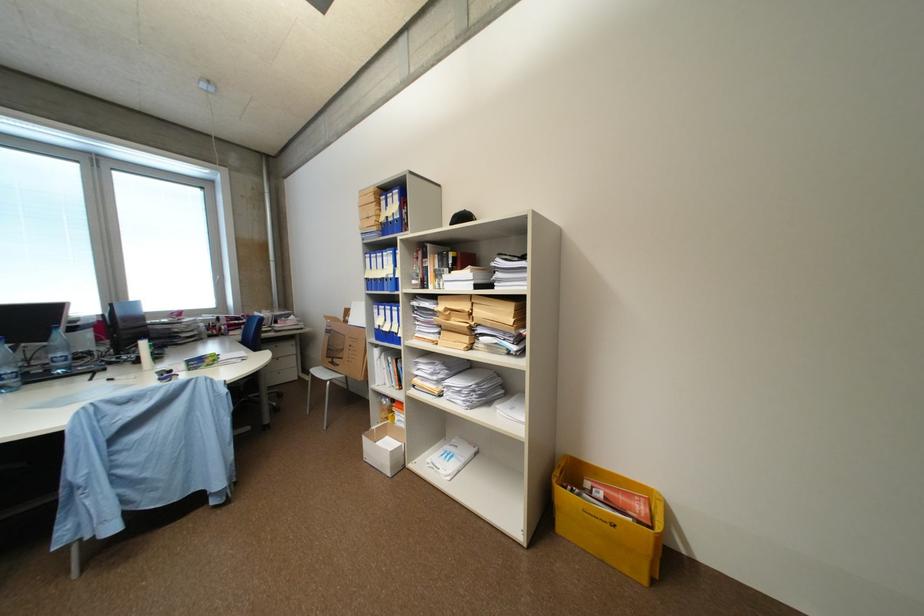
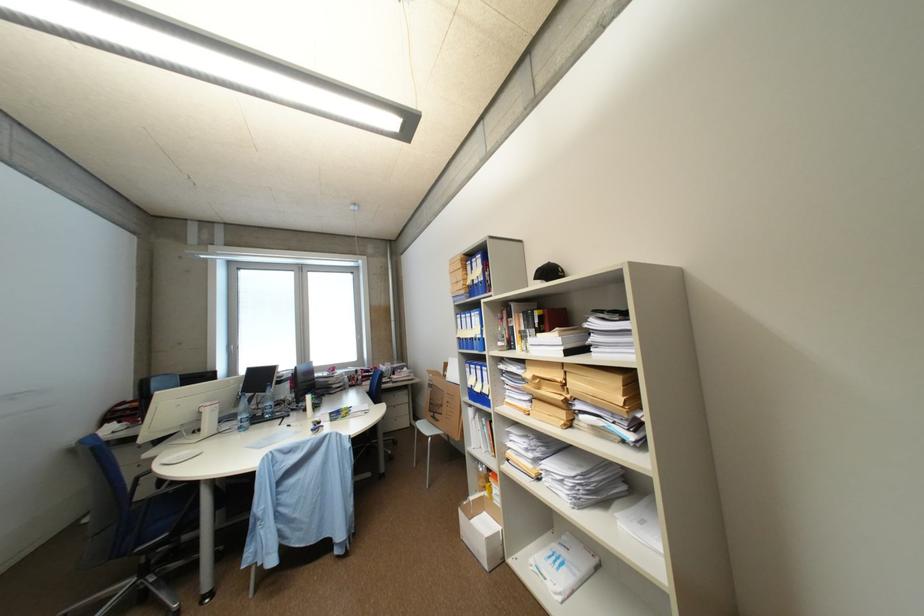
Question: Based on the continuous images, in which direction is the camera rotating? Reply with the corresponding letter.

Choices:
 (A) Left
 (B) Right
 (C) Up
 (D) Down

Answer: (A)